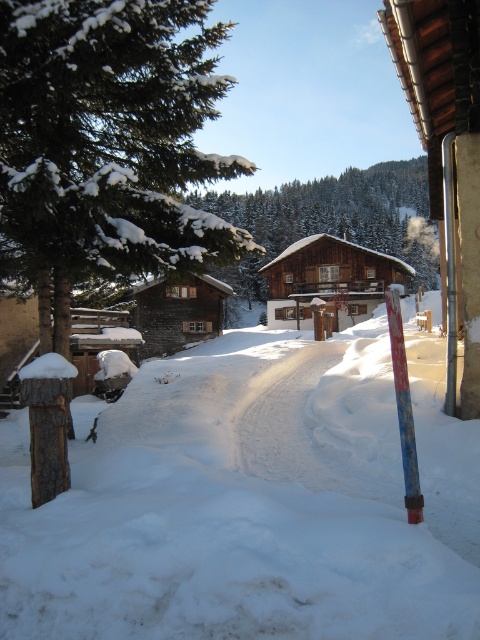
Is point (266, 449) behind point (435, 148)?

No, (266, 449) is closer to viewer.

What do you see at coordinates (250, 500) in the screenshot?
I see `white fluffy snow at center` at bounding box center [250, 500].

Find the location of `white fluffy snow at center`. white fluffy snow at center is located at coordinates (250, 500).

In the scene shown: Can you confirm if wooden cabin at center is positioned below blue painted wood pole at lower right?

Actually, wooden cabin at center is above blue painted wood pole at lower right.

Who is lower down, wooden cabin at center or blue painted wood pole at lower right?

blue painted wood pole at lower right is lower down.

Is point (276, 282) closer to viewer compared to point (406, 387)?

No, (276, 282) is further to viewer.

I want to click on wooden cabin at center, so click(328, 280).

Between green textured pine tree at left and blue painted wood pole at lower right, which one appears on the left side from the viewer's perspective?

green textured pine tree at left

Is point (182, 24) closer to camera compared to point (397, 304)?

No, it is behind (397, 304).

This screenshot has width=480, height=640. Identify the location of green textured pine tree at left. (109, 138).